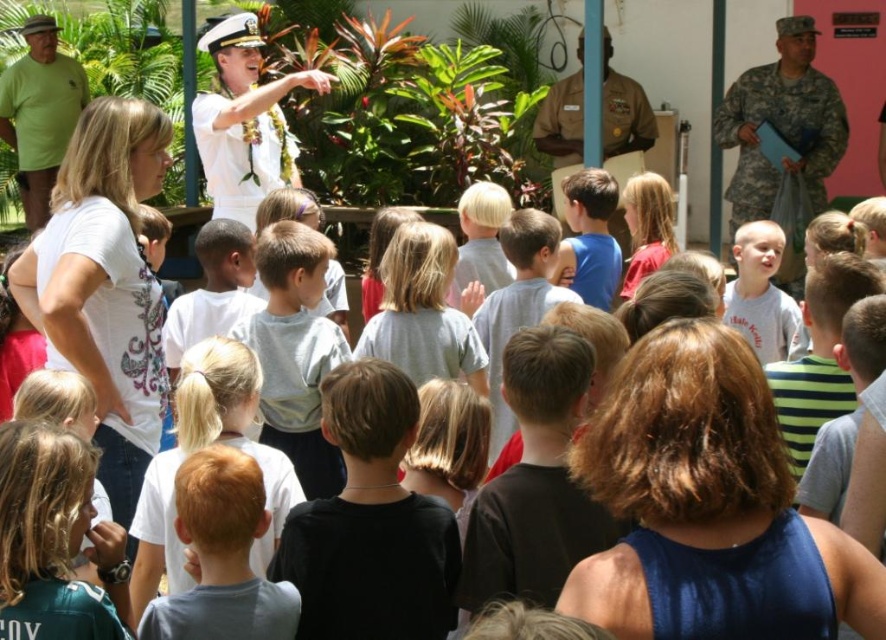
Between white uniform at upper center and light gray shirt at center, which one is positioned higher?

Positioned higher is white uniform at upper center.

Can you confirm if white uniform at upper center is positioned to the left of light gray shirt at center?

Correct, you'll find white uniform at upper center to the left of light gray shirt at center.

Is point (238, 99) positioned in front of point (472, 225)?

That is False.

Where is `white uniform at upper center`? white uniform at upper center is located at coordinates (245, 120).

Based on the photo, is light brown hair at center smaller than gray cotton shirt at center?

Yes.

The width and height of the screenshot is (886, 640). I want to click on light brown hair at center, so click(x=222, y=556).

Measure the distance between point [219,602] and camera.

The distance of point [219,602] from camera is 12.57 meters.

Image resolution: width=886 pixels, height=640 pixels. What are the coordinates of `light brown hair at center` in the screenshot? It's located at (222, 556).

Between point (447, 378) and point (5, 99), which one is positioned behind?

Point (5, 99)

Is light gray cotton shirt at center below green matte shirt at upper left?

Yes, light gray cotton shirt at center is below green matte shirt at upper left.

Does point (437, 330) lie behind point (58, 129)?

No, it is in front of (58, 129).

Locate an element on the screen. This screenshot has height=640, width=886. light gray cotton shirt at center is located at coordinates pyautogui.click(x=422, y=310).